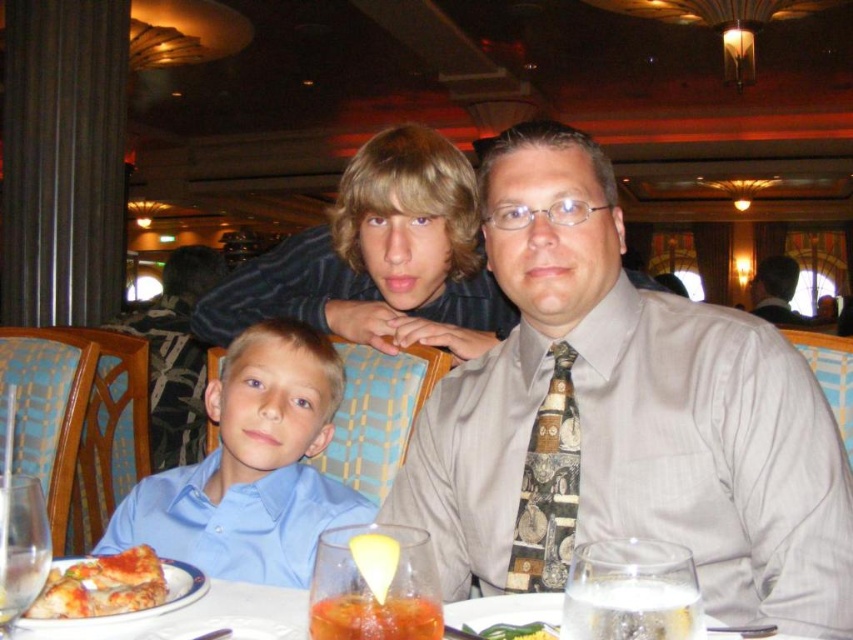
Which of these two, printed silk tie at center or light brown leather jacket at upper right, stands shorter?

With less height is printed silk tie at center.

Does printed silk tie at center appear under light brown leather jacket at upper right?

Yes.

Is point (560, 429) farther from viewer compared to point (801, 323)?

No, it is not.

The height and width of the screenshot is (640, 853). What are the coordinates of `printed silk tie at center` in the screenshot? It's located at (548, 486).

Looking at this image, is matte gray shirt at center above light brown leather jacket at upper right?

No.

Between matte gray shirt at center and light brown leather jacket at upper right, which one is positioned higher?

light brown leather jacket at upper right is above.

Identify the location of matte gray shirt at center. (625, 420).

You are a GUI agent. You are given a task and a screenshot of the screen. Output one action in this format:
    pyautogui.click(x=<x>, y=<y>)
    Task: Click on the matte gray shirt at center
    This screenshot has width=853, height=640.
    Given the screenshot: What is the action you would take?
    pyautogui.click(x=625, y=420)

Does printed silk tie at center appear on the right side of translucent glass bowl at center?

Yes, printed silk tie at center is to the right of translucent glass bowl at center.

Does printed silk tie at center have a lesser width compared to translucent glass bowl at center?

No.

At what (x,y) coordinates should I click in order to perform the action: click on printed silk tie at center. Please return your answer as a coordinate pair (x, y). Looking at the image, I should click on (548, 486).